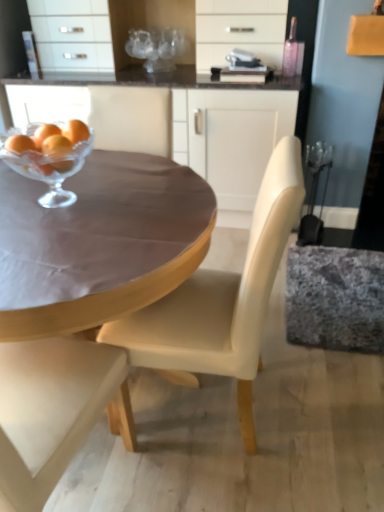
Where is `translucent glass tangerine at upper left`? translucent glass tangerine at upper left is located at coordinates (56, 145).

What is the approximate width of matte white cabinet at upper center?

matte white cabinet at upper center is 23.08 inches wide.

Find the location of a particular element. This screenshot has height=512, width=384. translucent glass tangerine at upper left is located at coordinates (56, 145).

Is matte brown table at center taller or shorter than translucent glass tangerine at upper left?

In the image, matte brown table at center appears to be taller than translucent glass tangerine at upper left.

Is matte brown table at center next to translucent glass tangerine at upper left and touching it?

There is a gap between matte brown table at center and translucent glass tangerine at upper left.

Considering the sizes of matte brown table at center and translucent glass tangerine at upper left in the image, is matte brown table at center bigger or smaller than translucent glass tangerine at upper left?

In the image, matte brown table at center appears to be larger than translucent glass tangerine at upper left.

How many degrees apart are the facing directions of matte brown table at center and translucent glass tangerine at upper left?

The facing directions of matte brown table at center and translucent glass tangerine at upper left are 103 degrees apart.

Which of these two, granite-like fabric swivel chair at right or translucent glass tangerine at upper left, is smaller?

translucent glass tangerine at upper left.

The height and width of the screenshot is (512, 384). I want to click on tangerine in front of the granite-like fabric swivel chair at right, so [56, 145].

Is granite-like fabric swivel chair at right oriented away from translucent glass tangerine at upper left?

No, granite-like fabric swivel chair at right is not facing the opposite direction of translucent glass tangerine at upper left.

Is matte cream chair at center in front of or behind matte white cabinet at upper center in the image?

Visually, matte cream chair at center is located in front of matte white cabinet at upper center.

Which of these two, matte cream chair at center or matte white cabinet at upper center, is bigger?

With larger size is matte white cabinet at upper center.

Based on the photo, is matte cream chair at center far away from matte white cabinet at upper center?

That's right, there is a large distance between matte cream chair at center and matte white cabinet at upper center.

Who is taller, matte white cabinet at upper center or matte cream chair at center?

Standing taller between the two is matte white cabinet at upper center.

Which is in front, matte white cabinet at upper center or matte cream chair at center?

matte cream chair at center is closer to the camera.

Is granite-like fabric swivel chair at right facing towards matte white cabinet at upper center?

No, granite-like fabric swivel chair at right is not aimed at matte white cabinet at upper center.

Considering the relative positions of granite-like fabric swivel chair at right and matte white cabinet at upper center in the image provided, is granite-like fabric swivel chair at right to the right of matte white cabinet at upper center from the viewer's perspective?

Indeed, granite-like fabric swivel chair at right is positioned on the right side of matte white cabinet at upper center.

Is point (295, 323) farther from viewer compared to point (122, 123)?

Yes.

Where is `cabinetry located on the left of granite-like fabric swivel chair at right`? cabinetry located on the left of granite-like fabric swivel chair at right is located at coordinates click(154, 108).

Would you say translucent glass tangerine at upper left is outside granite-like fabric swivel chair at right?

translucent glass tangerine at upper left is positioned outside granite-like fabric swivel chair at right.

Image resolution: width=384 pixels, height=512 pixels. Find the location of `swivel chair on the right of translucent glass tangerine at upper left`. swivel chair on the right of translucent glass tangerine at upper left is located at coordinates (335, 298).

Considering the sizes of objects translucent glass tangerine at upper left and granite-like fabric swivel chair at right in the image provided, who is smaller, translucent glass tangerine at upper left or granite-like fabric swivel chair at right?

translucent glass tangerine at upper left.

Which is in front, translucent glass tangerine at upper left or granite-like fabric swivel chair at right?

translucent glass tangerine at upper left is in front.

Is translucent glass tangerine at upper left directly adjacent to matte brown table at center?

There is a gap between translucent glass tangerine at upper left and matte brown table at center.

Is translucent glass tangerine at upper left not inside matte brown table at center?

translucent glass tangerine at upper left is positioned outside matte brown table at center.

From a real-world perspective, relative to matte brown table at center, is translucent glass tangerine at upper left vertically above or below?

From a real-world perspective, translucent glass tangerine at upper left is physically above matte brown table at center.

Considering the relative positions of translucent glass tangerine at upper left and matte brown table at center in the image provided, is translucent glass tangerine at upper left to the right of matte brown table at center from the viewer's perspective?

Yes.

Find the location of `tangerine lying above the matte brown table at center (from the image's perspective)`. tangerine lying above the matte brown table at center (from the image's perspective) is located at coordinates (56, 145).

You are a GUI agent. You are given a task and a screenshot of the screen. Output one action in this format:
    pyautogui.click(x=<x>, y=<y>)
    Task: Click on the swivel chair below the translucent glass tangerine at upper left (from the image's perspective)
    The height and width of the screenshot is (512, 384).
    Given the screenshot: What is the action you would take?
    pyautogui.click(x=335, y=298)

Estimate the real-world distances between objects in this image. Which object is closer to matte white cabinet at upper center, clear glass bowl at center or translucent glass tangerine at upper left?

clear glass bowl at center lies closer to matte white cabinet at upper center than the other object.

When comparing their distances from translucent glass tangerine at upper left, does matte brown table at center or granite-like fabric swivel chair at right seem further?

Among the two, granite-like fabric swivel chair at right is located further to translucent glass tangerine at upper left.

Considering their positions, is matte white cabinet at upper center positioned closer to clear glass bowl at center than matte cream chair at center?

matte cream chair at center is closer to clear glass bowl at center.

Based on their spatial positions, is matte brown table at center or matte cream chair at center closer to matte white cabinet at upper center?

matte brown table at center lies closer to matte white cabinet at upper center than the other object.

Based on the photo, considering their positions, is translucent glass tangerine at upper left positioned closer to granite-like fabric swivel chair at right than matte brown table at center?

matte brown table at center is positioned closer to the anchor granite-like fabric swivel chair at right.

When comparing their distances from matte white cabinet at upper center, does matte cream chair at center or translucent glass tangerine at upper left seem further?

matte cream chair at center lies further to matte white cabinet at upper center than the other object.

Looking at the image, which one is located further to matte white cabinet at upper center, translucent glass tangerine at upper left or clear glass bowl at center?

Among the two, translucent glass tangerine at upper left is located further to matte white cabinet at upper center.

From the image, which object appears to be nearer to matte cream chair at center, matte white cabinet at upper center or clear glass bowl at center?

clear glass bowl at center is closer to matte cream chair at center.

Find the location of a particular element. tangerine situated between clear glass bowl at center and matte cream chair at center from left to right is located at coordinates (56, 145).

Where is `chair between matte white cabinet at upper center and granite-like fabric swivel chair at right vertically`? This screenshot has height=512, width=384. chair between matte white cabinet at upper center and granite-like fabric swivel chair at right vertically is located at coordinates (222, 300).

Identify the location of chair between translucent glass tangerine at upper left and granite-like fabric swivel chair at right in the horizontal direction. Image resolution: width=384 pixels, height=512 pixels. (222, 300).

Locate an element on the screen. This screenshot has height=512, width=384. chair between clear glass bowl at center and granite-like fabric swivel chair at right from left to right is located at coordinates (222, 300).